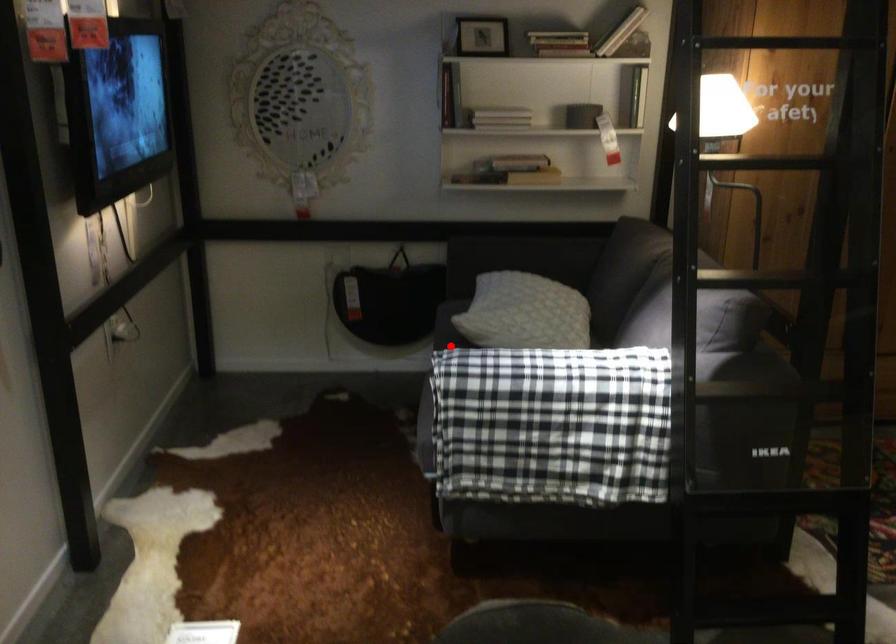
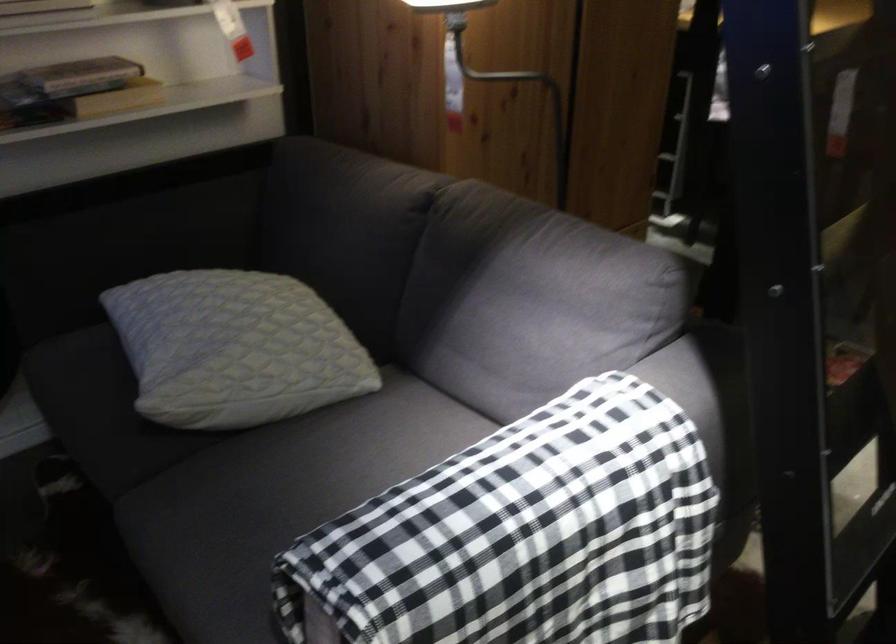
Locate, in the second image, the point that corresponds to the highlighted location in the first image.

(131, 448)